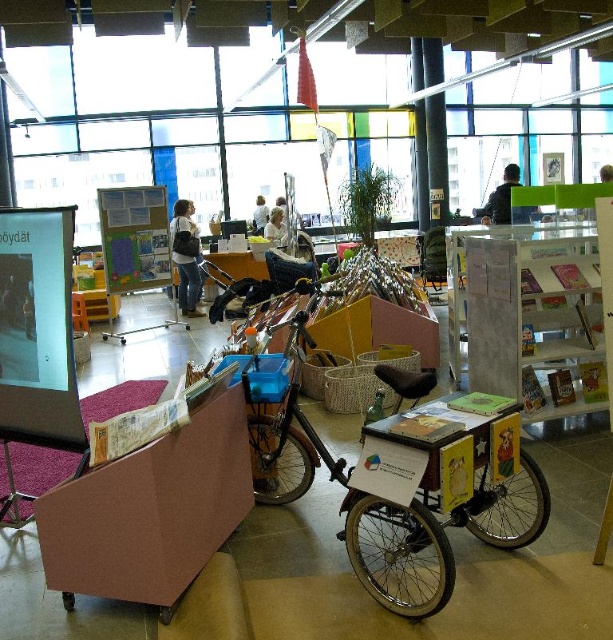
Question: Which point is closer to the camera?

Choices:
 (A) (192, 314)
 (B) (153, 442)
 (C) (607, 177)

Answer: (B)

Question: Does pink cardboard box at lower left appear on the left side of light brown leather jacket at upper center?

Choices:
 (A) yes
 (B) no

Answer: (B)

Question: Which of the following is the closest to the observer?

Choices:
 (A) (183, 294)
 (B) (257, 212)
 (C) (207, 422)
 (D) (281, 228)

Answer: (C)

Question: Does denim jacket at center appear under light brown leather jacket at upper center?

Choices:
 (A) no
 (B) yes

Answer: (B)

Question: Based on their relative distances, which object is farther from the light brown hair at center?

Choices:
 (A) pink cardboard box at lower left
 (B) blonde hair at upper center
 (C) denim jacket at center
 (D) dark blue jacket at upper center

Answer: (A)

Question: Does metallic bicycle at center have a smaller size compared to dark blue jacket at upper center?

Choices:
 (A) no
 (B) yes

Answer: (A)